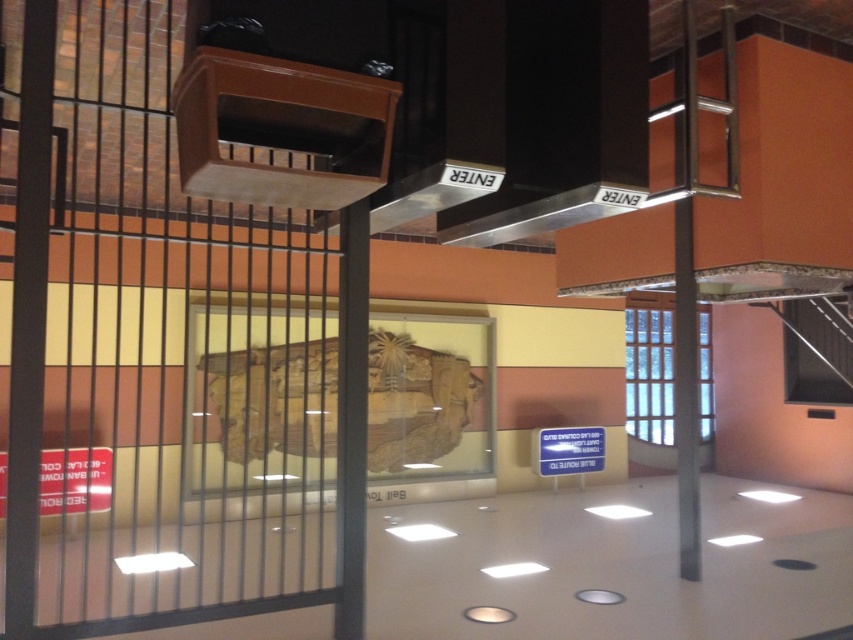
You are an interior designer assessing the space. You need to install a new light fixture that must be placed above the taller object between the wooden carving at center and the silver metallic exhaust hood at center. Which object should the light fixture be positioned above?

The wooden carving at center is taller than the silver metallic exhaust hood at center, so the light fixture should be positioned above the wooden carving at center.

You are a visitor in the museum and want to take a photo of the wooden carving at center and the silver metallic exhaust hood at center. Which object is closer to you so that you can focus on it first?

The wooden carving at center is closer to you than the silver metallic exhaust hood at center, so you can focus on it first.

From the picture: You are a visitor standing at the point labeled point (177, 572). You want to reach the nearest exit marked by the word ENTER on the ceiling beams. The distance between you and the nearest exit is 13.30 feet. Can you walk straight to it without any obstacles?

The distance between you and the nearest exit is 13.30 feet, so yes, you can walk straight to it without any obstacles since there are no mentioned obstacles in the scene description.